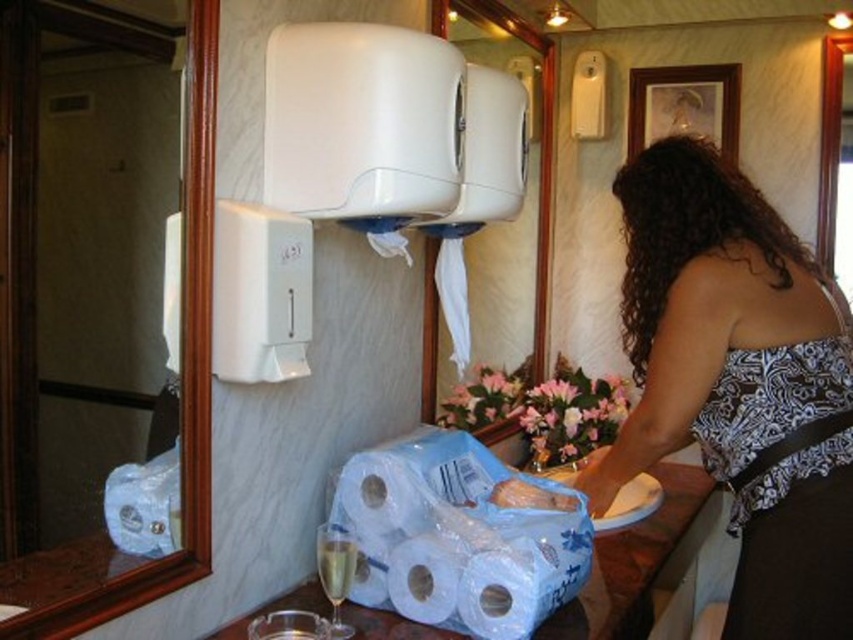
Measure the distance between point (x=762, y=220) and camera.

Point (x=762, y=220) and camera are 5.16 feet apart from each other.

Is patterned fabric top at center positioned in front of black satin apron at right?

No, patterned fabric top at center is further to the viewer.

Does point (766, 211) come closer to viewer compared to point (779, 547)?

No, it is behind (779, 547).

Find the location of a particular element. The height and width of the screenshot is (640, 853). patterned fabric top at center is located at coordinates (738, 381).

Between point (160, 541) and point (421, 614), which one is positioned in front?

Positioned in front is point (160, 541).

Which of these two, white glossy toilet paper at lower left or white matte paper towel at lower center, stands taller?

white glossy toilet paper at lower left is taller.

Which is in front, point (178, 531) or point (399, 596)?

Point (178, 531) is in front.

Identify the location of white glossy toilet paper at lower left. (144, 506).

Between white matte paper towel at lower center and clear glass wine glass at lower left, which one is positioned higher?

clear glass wine glass at lower left

Which is below, white matte paper towel at lower center or clear glass wine glass at lower left?

white matte paper towel at lower center

Describe the element at coordinates (424, 579) in the screenshot. I see `white matte paper towel at lower center` at that location.

You are a GUI agent. You are given a task and a screenshot of the screen. Output one action in this format:
    pyautogui.click(x=<x>, y=<y>)
    Task: Click on the white matte paper towel at lower center
    The height and width of the screenshot is (640, 853).
    Given the screenshot: What is the action you would take?
    pyautogui.click(x=424, y=579)